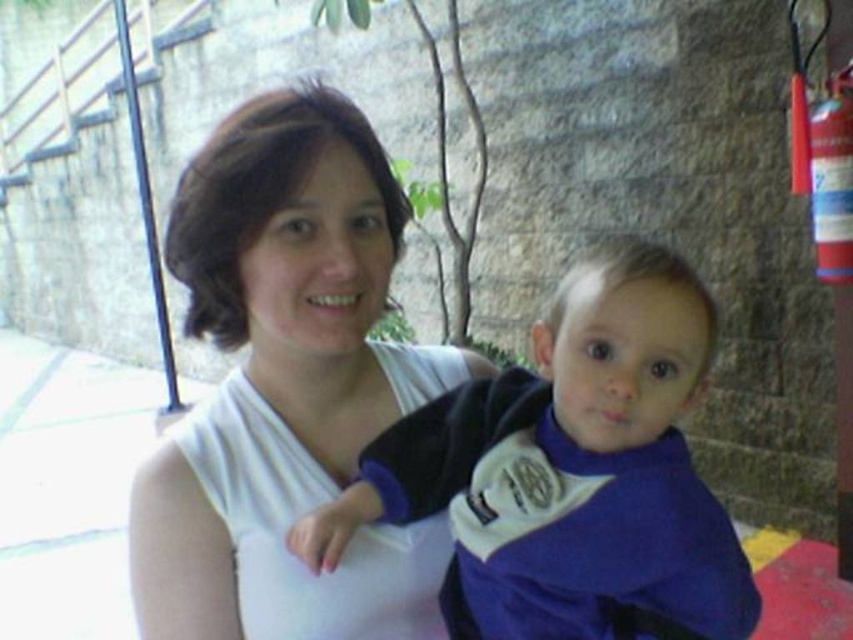
What are the coordinates of the white matte shirt at center?

The white matte shirt at center is located at coordinates point (286,387).